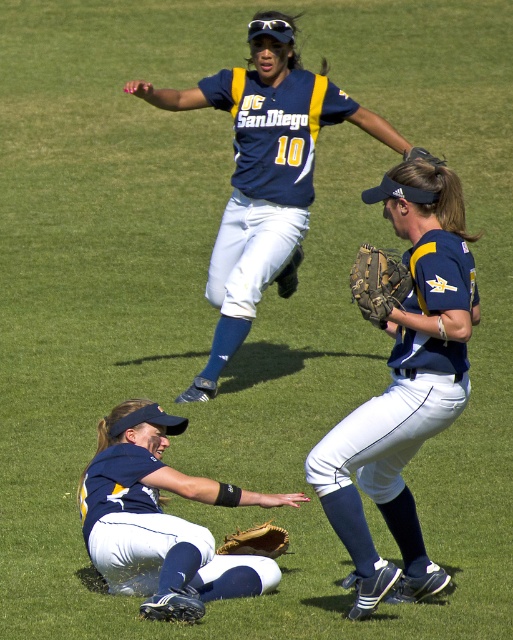
Question: Among these points, which one is farthest from the camera?

Choices:
 (A) (445, 339)
 (B) (205, 566)
 (C) (373, 292)
 (D) (297, 157)

Answer: (D)

Question: Which point is farther to the camera?

Choices:
 (A) (274, 554)
 (B) (216, 74)
 (C) (366, 280)
 (D) (247, 116)

Answer: (B)

Question: Does matte blue jersey at upper center have a greater width compared to navy blue jersey at upper center?

Choices:
 (A) yes
 (B) no

Answer: (A)

Question: Is navy blue jersey at upper center thinner than brown leather glove at lower center?

Choices:
 (A) yes
 (B) no

Answer: (B)

Question: Among these objects, which one is farthest from the camera?

Choices:
 (A) brown leather glove at lower center
 (B) matte blue uniform at center
 (C) brown leather baseball glove at center
 (D) navy blue jersey at upper center

Answer: (D)

Question: In this image, where is matte blue jersey at upper center located relative to brown leather baseball glove at center?

Choices:
 (A) right
 (B) left

Answer: (B)